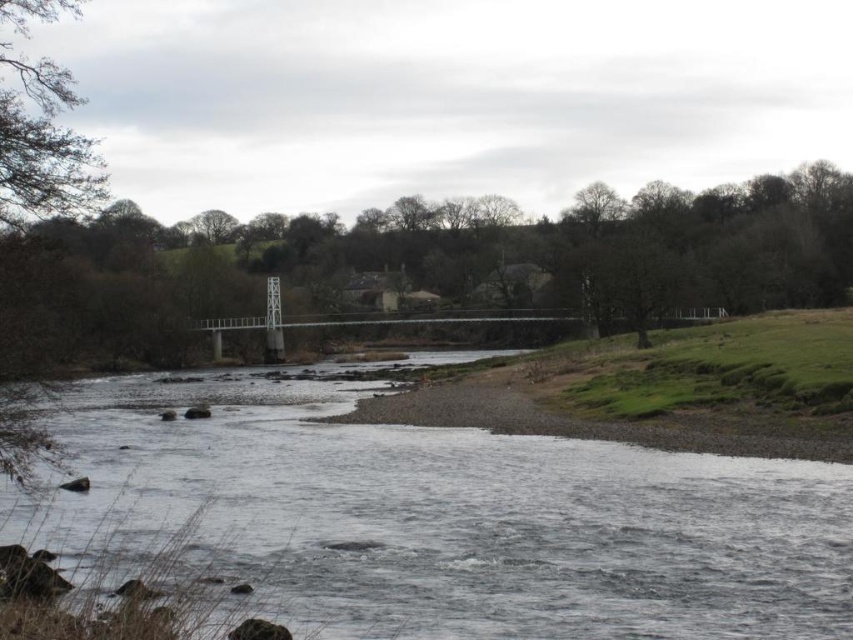
You are standing on the suspension bridge and want to cross to the right bank. Which direction should you face to see the brown textured tree at left and the gray smooth river at center?

You should face towards the left bank because the brown textured tree at left is located on the left side of the gray smooth river at center, which is directly below the suspension bridge.

Looking at this image, you are a hiker carrying a 30 meter long rope. You need to cross the river using the suspension bridge but want to secure the rope to a tree on the opposite bank. The gray smooth river at center is between you and the brown textured tree at left. Can you safely tie the rope to the tree on the other side using your current rope length?

The distance between the gray smooth river at center and the brown textured tree at left is 24.34 meters. Since your rope is 30 meters long, which is longer than the required distance, you can safely tie the rope to the tree on the other side.